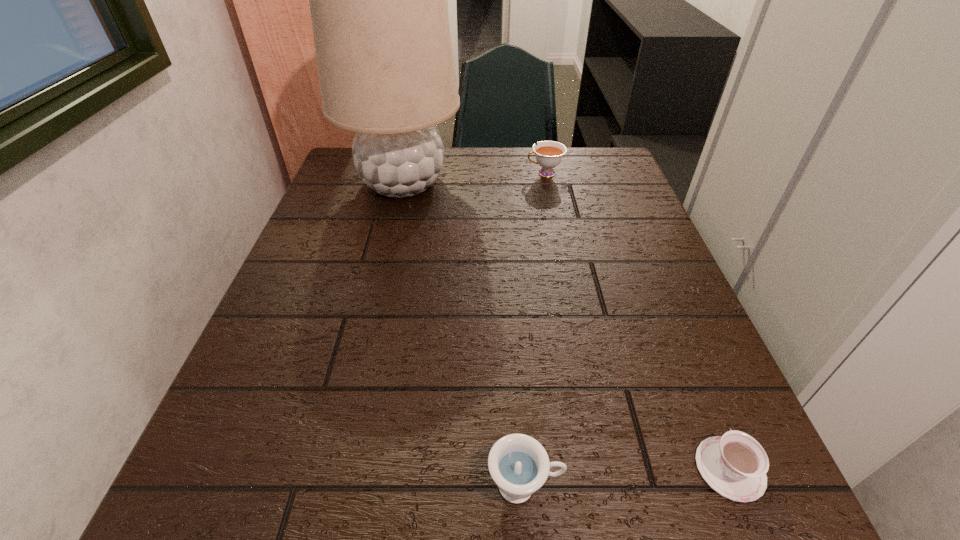
What are the coordinates of `the tallest object` in the screenshot? It's located at (377, 0).

Locate an element on the screen. Image resolution: width=960 pixels, height=540 pixels. the leftmost object is located at coordinates (377, 0).

Find the location of a particular element. the second teacup from right to left is located at coordinates click(549, 154).

The width and height of the screenshot is (960, 540). In order to click on the farthest teacup in this screenshot , I will do `click(549, 154)`.

Where is `the leftmost teacup`? Image resolution: width=960 pixels, height=540 pixels. the leftmost teacup is located at coordinates (519, 465).

Find the location of a particular element. Image resolution: width=960 pixels, height=540 pixels. the rightmost teacup is located at coordinates (735, 465).

I want to click on the shortest teacup, so click(x=735, y=465).

Identify the location of free location located on the front of the lampshade. (373, 303).

Identify the location of free space located 0.220m on the side of the second object from right to left with the handle. This screenshot has height=540, width=960. (445, 173).

Where is `vacant area situated 0.060m on the side of the second object from right to left with the handle`? Image resolution: width=960 pixels, height=540 pixels. vacant area situated 0.060m on the side of the second object from right to left with the handle is located at coordinates (504, 173).